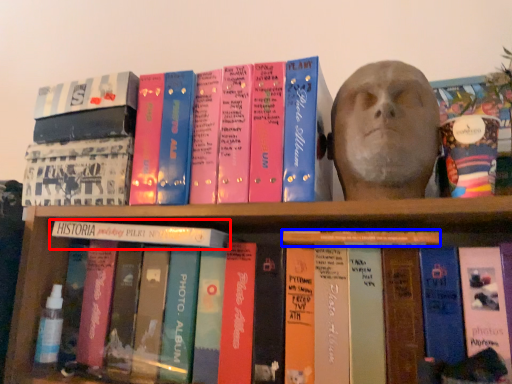
Question: Which object is closer to the camera taking this photo, book (highlighted by a red box) or book (highlighted by a blue box)?

Choices:
 (A) book
 (B) book

Answer: (B)